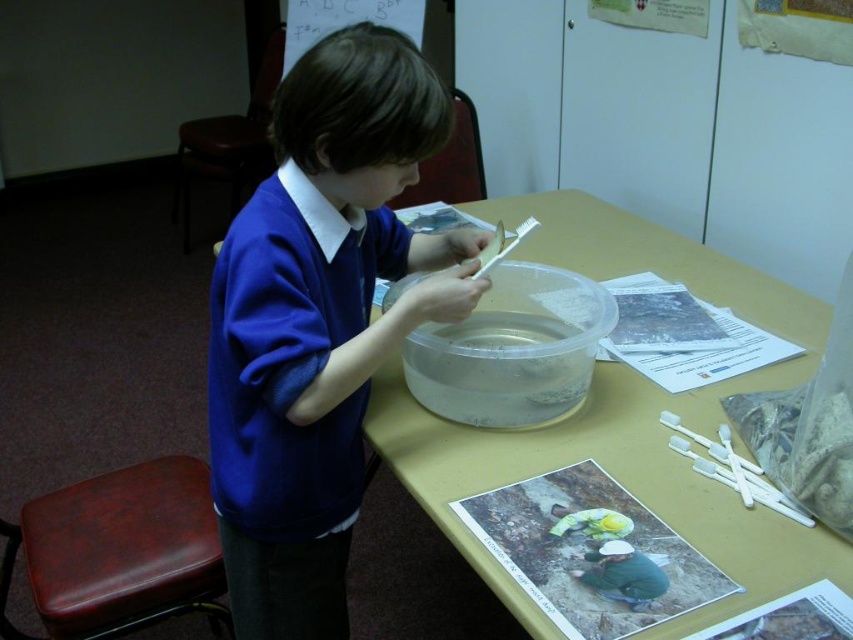
Question: Is blue fabric shirt at center wider than brown leather stool at lower left?

Choices:
 (A) yes
 (B) no

Answer: (B)

Question: Which object is farther from the camera taking this photo?

Choices:
 (A) blue fabric shirt at center
 (B) brown leather stool at lower left

Answer: (B)

Question: Is translucent plastic table at center positioned in front of brown leather stool at lower left?

Choices:
 (A) yes
 (B) no

Answer: (A)

Question: In this image, where is blue fabric shirt at center located relative to translucent plastic table at center?

Choices:
 (A) right
 (B) left

Answer: (B)

Question: Which of the following is the farthest from the observer?

Choices:
 (A) (621, 212)
 (B) (289, 368)

Answer: (A)

Question: Considering the real-world distances, which object is farthest from the blue fabric shirt at center?

Choices:
 (A) brown leather stool at lower left
 (B) translucent plastic table at center

Answer: (A)